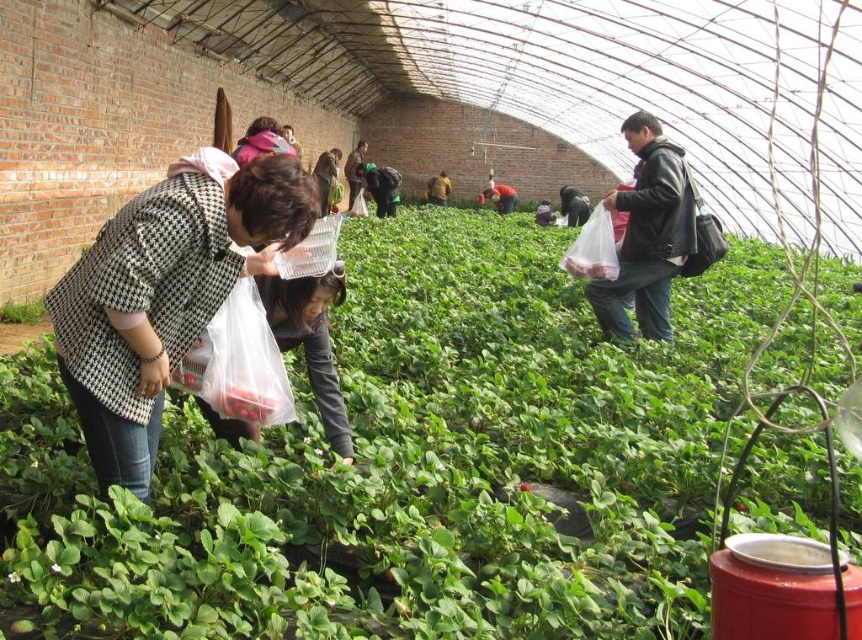
Question: Which of these objects is positioned closest to the patterned fabric coat at center-left?

Choices:
 (A) green leafy plant at lower left
 (B) green leafy plant at center

Answer: (B)

Question: Among these points, which one is farthest from the camera?

Choices:
 (A) (151, 388)
 (B) (4, 307)
 (C) (489, 339)

Answer: (B)

Question: Which point is closer to the camera?

Choices:
 (A) (89, 296)
 (B) (39, 317)

Answer: (A)

Question: Can you confirm if green leafy plant at center is smaller than patterned fabric coat at center-left?

Choices:
 (A) no
 (B) yes

Answer: (A)

Question: Is the position of patterned fabric coat at center-left less distant than that of green leafy plant at lower left?

Choices:
 (A) yes
 (B) no

Answer: (A)

Question: Does patterned fabric coat at center-left have a greater width compared to green leafy plant at lower left?

Choices:
 (A) no
 (B) yes

Answer: (B)